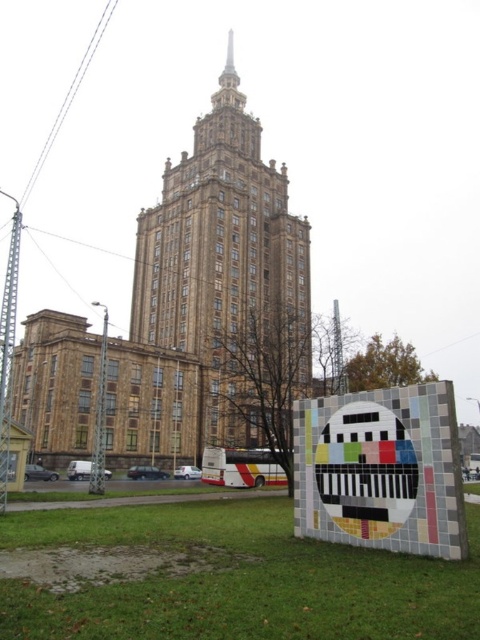
You are standing in front of the historic building and want to take a photo that includes both the brown stone tower at center and the multicolored mosaic sign at lower right. Based on their positions, which object should you position lower in your camera frame to ensure both are visible?

The multicolored mosaic sign at lower right should be positioned lower in your camera frame because the brown stone tower at center is located above it, so placing the sign lower will allow both to fit within the frame.

You are standing in the grassy area in front of the historic building. You notice a point marked at coordinates (228, 275). Which object does this point correspond to?

The point corresponds to the brown stone tower at center.

You are planning to install a new pathway between the brown stone tower at center and the multicolored mosaic sign at lower right. The pathway requires a minimum of 30 meters of space. Based on the scene, will there be enough space to construct this pathway?

The brown stone tower at center and multicolored mosaic sign at lower right are 35.96 meters apart from each other, which exceeds the required 30 meters. Therefore, there is sufficient space to construct the pathway between them.